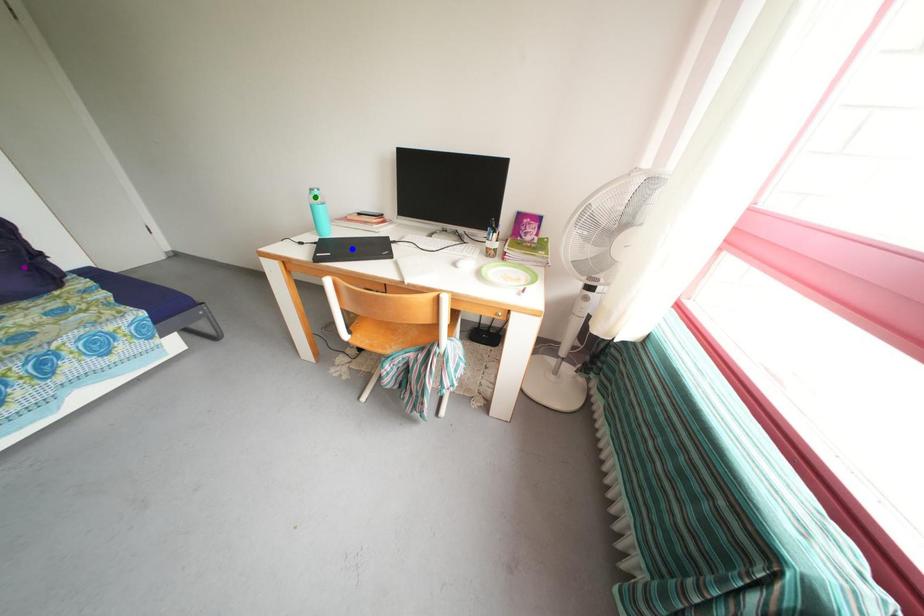
In the scene shown: Order these from nearest to farthest:
green point | purple point | blue point

1. green point
2. blue point
3. purple point